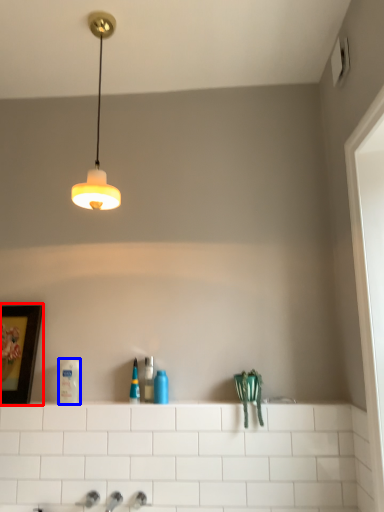
Question: Which of the following is the farthest to the observer, picture frame (highlighted by a red box) or toiletry (highlighted by a blue box)?

Choices:
 (A) picture frame
 (B) toiletry

Answer: (A)